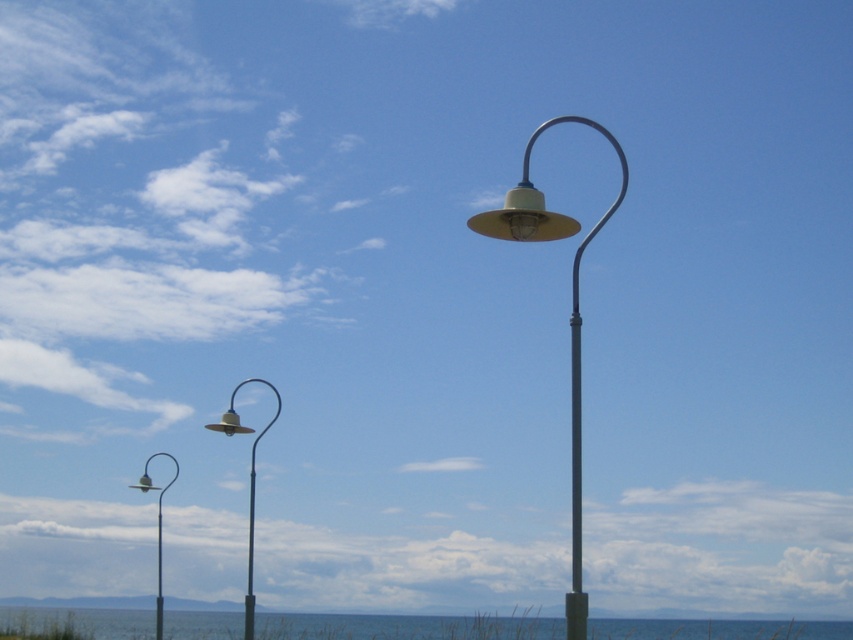
Which is below, blue water at lower center or matte silver lamp post at left?

Positioned lower is blue water at lower center.

Which is above, blue water at lower center or matte silver lamp post at left?

matte silver lamp post at left

Who is more distant from viewer, (201,621) or (173,480)?

Positioned behind is point (201,621).

The image size is (853, 640). I want to click on blue water at lower center, so click(405, 627).

Between matte yellow metal lamp post at center and metallic silver pole at center, which one appears on the right side from the viewer's perspective?

Positioned to the right is matte yellow metal lamp post at center.

Does matte yellow metal lamp post at center appear on the left side of metallic silver pole at center?

No, matte yellow metal lamp post at center is not to the left of metallic silver pole at center.

You are a GUI agent. You are given a task and a screenshot of the screen. Output one action in this format:
    pyautogui.click(x=<x>, y=<y>)
    Task: Click on the matte yellow metal lamp post at center
    This screenshot has width=853, height=640.
    Given the screenshot: What is the action you would take?
    pyautogui.click(x=569, y=317)

What are the coordinates of `matte yellow metal lamp post at center` in the screenshot? It's located at (569, 317).

Which is behind, point (613, 209) or point (175, 477)?

Point (175, 477)

Consider the image. Does matte yellow metal lamp post at center appear on the left side of matte silver lamp post at left?

Incorrect, matte yellow metal lamp post at center is not on the left side of matte silver lamp post at left.

Image resolution: width=853 pixels, height=640 pixels. What do you see at coordinates (569, 317) in the screenshot?
I see `matte yellow metal lamp post at center` at bounding box center [569, 317].

At what (x,y) coordinates should I click in order to perform the action: click on matte yellow metal lamp post at center. Please return your answer as a coordinate pair (x, y). This screenshot has height=640, width=853. Looking at the image, I should click on (569, 317).